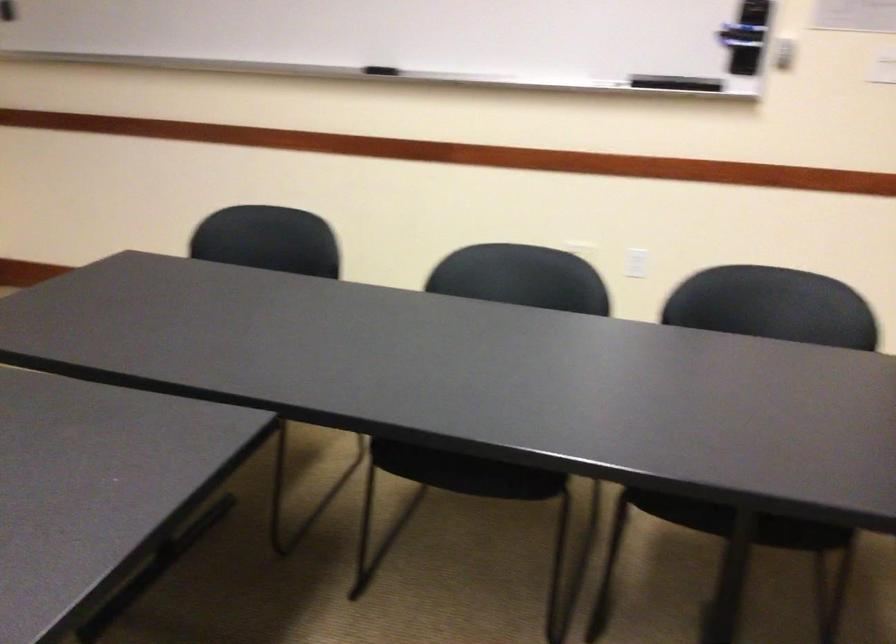
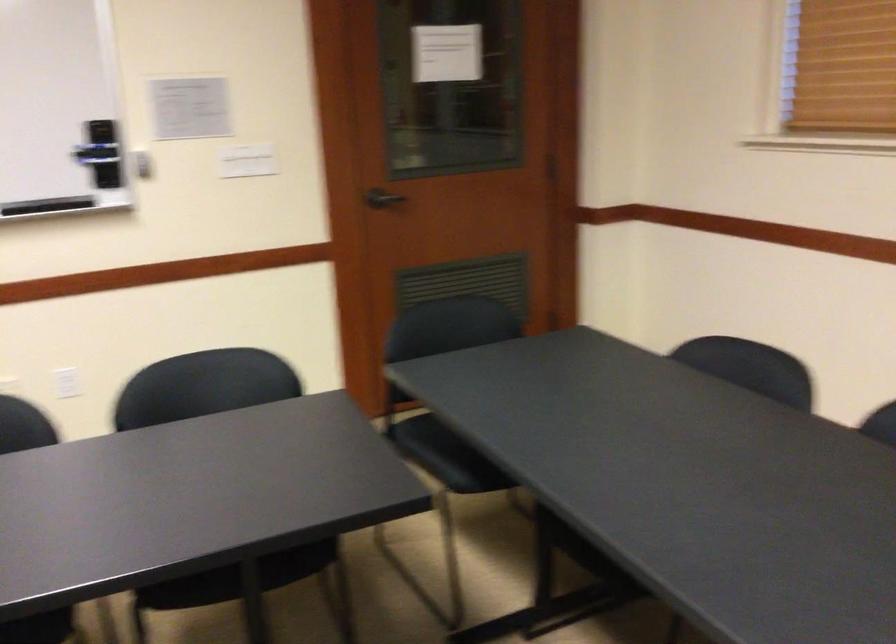
Question: I am providing you with two images of the same scene from different viewpoints. After the viewpoint changes to image2, which objects are now occluded?

Choices:
 (A) chair sitting surface
 (B) white light switch
 (C) black marker holder
 (D) none of these

Answer: (D)